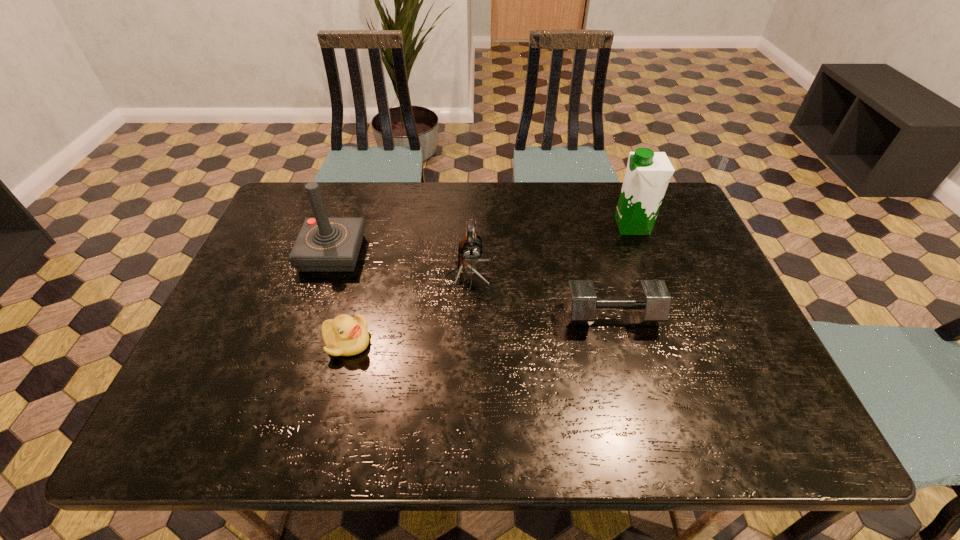
This screenshot has height=540, width=960. I want to click on blank region between the soya milk and the dumbbell, so click(621, 271).

Locate which object is the third closest to the earphone. Please provide its 2D coordinates. Your answer should be formatted as a tuple, i.e. [(x, y)], where the tuple contains the x and y coordinates of a point satisfying the conditions above.

[(323, 244)]

At what (x,y) coordinates should I click in order to perform the action: click on object that is the second nearest to the earphone. Please return your answer as a coordinate pair (x, y). Looking at the image, I should click on (344, 335).

Find the location of a particular element. The height and width of the screenshot is (540, 960). free spot that satisfies the following two spatial constraints: 1. on the front-facing side of the soya milk; 2. on the rectangular base of the joystick is located at coordinates (642, 253).

In order to click on free space that satisfies the following two spatial constraints: 1. on the front-facing side of the soya milk; 2. on the rectangular base of the joystick in this screenshot , I will do coord(642,253).

I want to click on vacant space that satisfies the following two spatial constraints: 1. on the front side of the third object from left to right; 2. on the left side of the dumbbell, so click(467, 316).

This screenshot has width=960, height=540. I want to click on vacant point that satisfies the following two spatial constraints: 1. on the front side of the dumbbell; 2. on the front-facing side of the duckling, so click(617, 342).

I want to click on vacant region that satisfies the following two spatial constraints: 1. on the front-facing side of the soya milk; 2. on the front side of the dumbbell, so click(x=666, y=316).